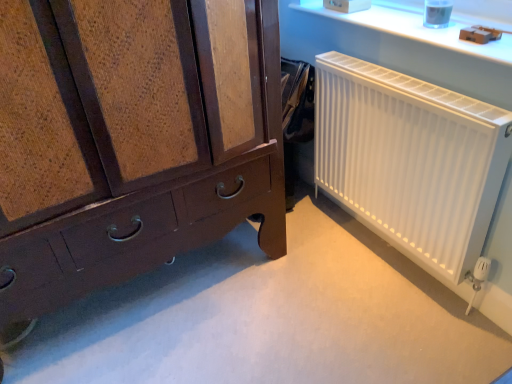
Question: From the image's perspective, does matte brown wooden chest of drawers at lower left appear lower than white matte radiator at right?

Choices:
 (A) yes
 (B) no

Answer: (B)

Question: Does matte brown wooden chest of drawers at lower left have a smaller size compared to white matte radiator at right?

Choices:
 (A) yes
 (B) no

Answer: (B)

Question: From a real-world perspective, is matte brown wooden chest of drawers at lower left on white matte radiator at right?

Choices:
 (A) no
 (B) yes

Answer: (B)

Question: Considering the relative sizes of matte brown wooden chest of drawers at lower left and white matte radiator at right in the image provided, is matte brown wooden chest of drawers at lower left shorter than white matte radiator at right?

Choices:
 (A) no
 (B) yes

Answer: (A)

Question: Could you tell me if matte brown wooden chest of drawers at lower left is facing white matte radiator at right?

Choices:
 (A) yes
 (B) no

Answer: (B)

Question: Is matte brown wooden chest of drawers at lower left at the right side of white matte radiator at right?

Choices:
 (A) yes
 (B) no

Answer: (B)

Question: Would you consider white matte radiator at right to be distant from matte brown wooden chest of drawers at lower left?

Choices:
 (A) no
 (B) yes

Answer: (A)

Question: Is white matte radiator at right positioned behind matte brown wooden chest of drawers at lower left?

Choices:
 (A) no
 (B) yes

Answer: (B)

Question: Considering the relative sizes of white matte radiator at right and matte brown wooden chest of drawers at lower left in the image provided, is white matte radiator at right thinner than matte brown wooden chest of drawers at lower left?

Choices:
 (A) yes
 (B) no

Answer: (A)

Question: From the image's perspective, is white matte radiator at right above matte brown wooden chest of drawers at lower left?

Choices:
 (A) yes
 (B) no

Answer: (B)

Question: Is white matte radiator at right facing away from matte brown wooden chest of drawers at lower left?

Choices:
 (A) yes
 (B) no

Answer: (B)

Question: Is white matte radiator at right at the right side of matte brown wooden chest of drawers at lower left?

Choices:
 (A) yes
 (B) no

Answer: (A)

Question: From the image's perspective, is white plastic radiator at upper right below matte brown wooden chest of drawers at lower left?

Choices:
 (A) no
 (B) yes

Answer: (A)